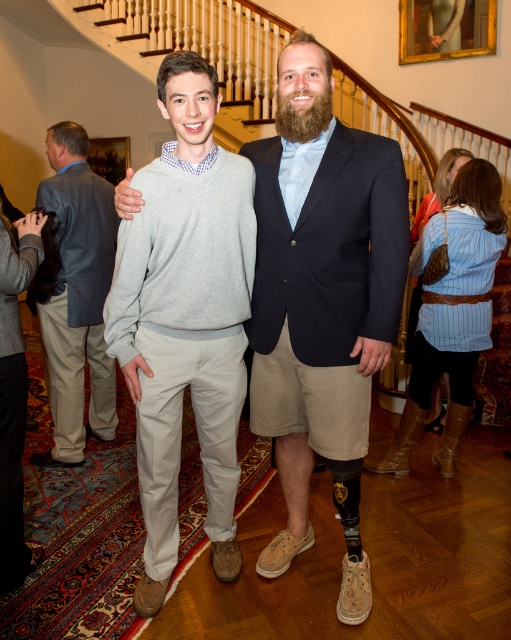
Can you confirm if gray cotton sweater at center is thinner than gray sweater at center?

Yes.

I want to click on gray cotton sweater at center, so click(x=184, y=320).

I want to click on gray cotton sweater at center, so click(x=184, y=320).

Between matte black suit at center and gray sweater at center, which one appears on the left side from the viewer's perspective?

Positioned to the left is gray sweater at center.

Can you confirm if matte black suit at center is positioned to the right of gray sweater at center?

Yes, matte black suit at center is to the right of gray sweater at center.

Describe the element at coordinates (321, 301) in the screenshot. I see `matte black suit at center` at that location.

Find the location of a particular element. The image size is (511, 640). matte black suit at center is located at coordinates (321, 301).

Consider the image. Is matte black suit at center thinner than gray cotton sweater at center?

No.

Describe the element at coordinates (321, 301) in the screenshot. I see `matte black suit at center` at that location.

Is point (307, 532) farther from viewer compared to point (212, 84)?

Yes.

Where is `matte black suit at center`? The image size is (511, 640). matte black suit at center is located at coordinates (321, 301).